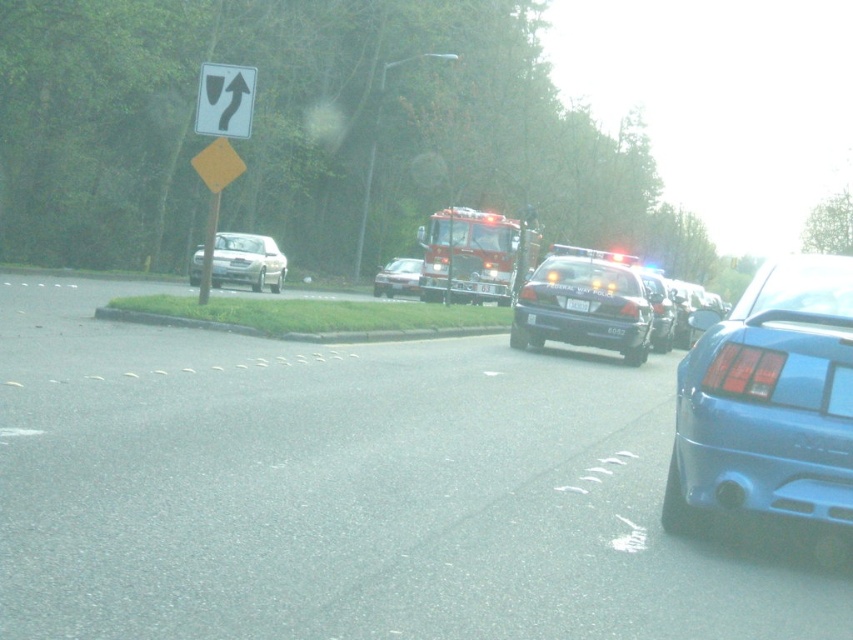
Question: Which object is farther from the camera taking this photo?

Choices:
 (A) metallic blue police car at center
 (B) silver metallic sedan at center
 (C) black plastic license plate at center

Answer: (B)

Question: Among these objects, which one is nearest to the camera?

Choices:
 (A) black plastic license plate at center
 (B) silver metallic sedan at center
 (C) red metallic fire truck at center

Answer: (A)

Question: Is satin silver sedan at left below silver metallic sedan at center?

Choices:
 (A) no
 (B) yes

Answer: (B)

Question: Can you confirm if blue matte car at lower right is positioned above satin silver sedan at left?

Choices:
 (A) no
 (B) yes

Answer: (A)

Question: Which point is closer to the camera?

Choices:
 (A) satin silver sedan at left
 (B) metallic blue police car at center
 (C) red metallic fire truck at center
 (D) black plastic license plate at center

Answer: (A)

Question: Is metallic blue police car at center below white plastic traffic sign at upper left?

Choices:
 (A) no
 (B) yes

Answer: (B)